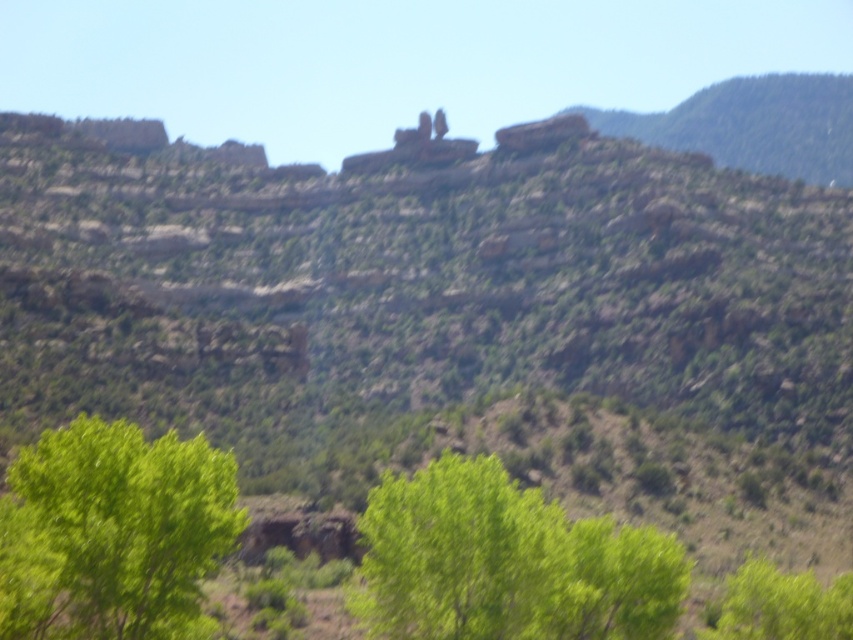
Measure the distance between green leafy tree at lower right and camera.

green leafy tree at lower right and camera are 73.46 meters apart.

In order to click on green leafy tree at lower right in this screenshot , I will do `click(782, 605)`.

Is point (175, 518) in front of point (512, 141)?

Yes, point (175, 518) is in front of point (512, 141).

In order to click on green leafy tree at lower left in this screenshot , I will do `click(113, 532)`.

Between point (469, 572) and point (572, 118), which one is positioned behind?

Point (572, 118)

Who is more forward, (466, 516) or (535, 138)?

Point (466, 516) is more forward.

Which is in front, point (376, 525) or point (524, 147)?

Positioned in front is point (376, 525).

The image size is (853, 640). Find the location of `green leafy tree at center`. green leafy tree at center is located at coordinates (506, 563).